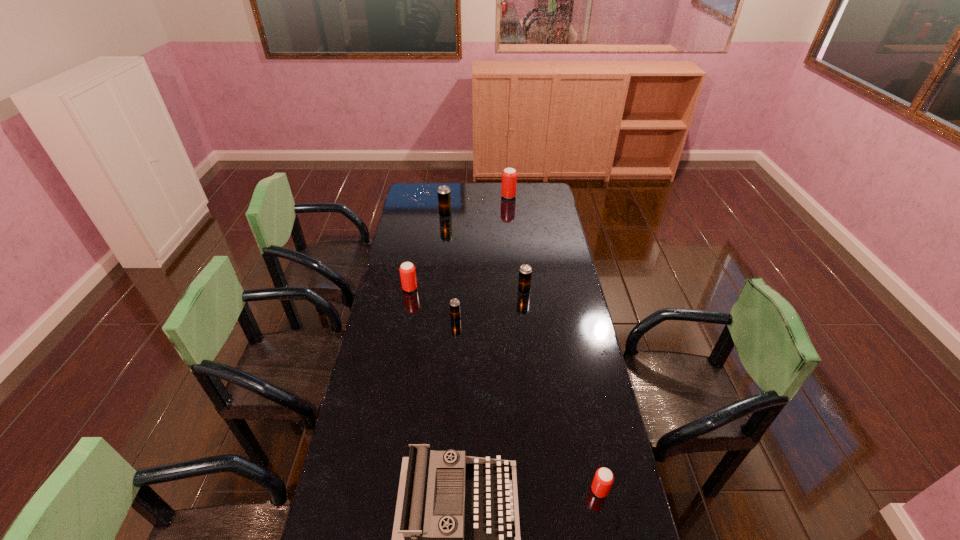
Identify the location of the farthest object. The height and width of the screenshot is (540, 960). (509, 175).

Identify the location of the second red beer can from left to right. (509, 175).

Locate an element on the screen. The image size is (960, 540). the farthest black beer can is located at coordinates (444, 194).

You are a GUI agent. You are given a task and a screenshot of the screen. Output one action in this format:
    pyautogui.click(x=<x>, y=<y>)
    Task: Click on the second farthest object
    
    Given the screenshot: What is the action you would take?
    pyautogui.click(x=444, y=194)

The width and height of the screenshot is (960, 540). What are the coordinates of `the rightmost black beer can` in the screenshot? It's located at (525, 272).

What are the coordinates of `the second smallest black beer can` in the screenshot? It's located at (525, 272).

You are a GUI agent. You are given a task and a screenshot of the screen. Output one action in this format:
    pyautogui.click(x=<x>, y=<y>)
    Task: Click on the leftmost red beer can
    
    Given the screenshot: What is the action you would take?
    pyautogui.click(x=407, y=270)

Find the location of a particular element. Image resolution: width=960 pixels, height=540 pixels. the leftmost beer can is located at coordinates (407, 270).

Locate an element on the screen. This screenshot has width=960, height=540. the smallest red beer can is located at coordinates (603, 479).

Find the location of a particular element. the nearest beer can is located at coordinates (603, 479).